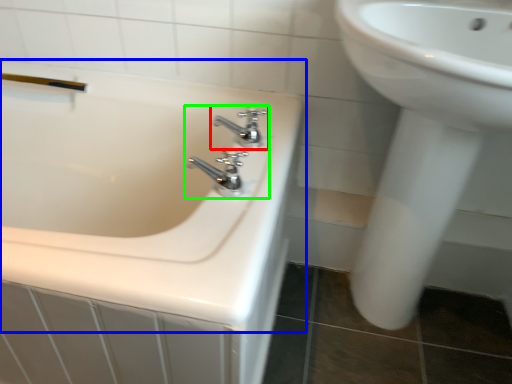
Question: Considering the real-world distances, which object is closest to tap (highlighted by a red box)? bathtub (highlighted by a blue box) or tap (highlighted by a green box).

Choices:
 (A) bathtub
 (B) tap

Answer: (B)